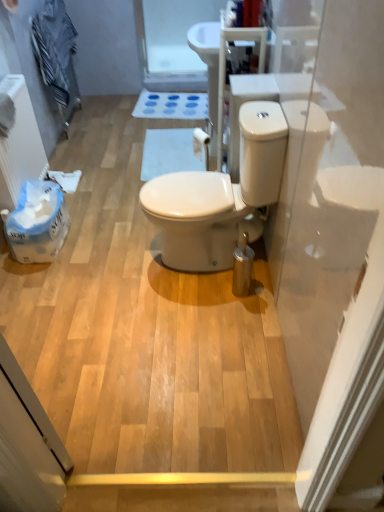
I want to click on free location in front of white glossy toilet at center, so click(197, 321).